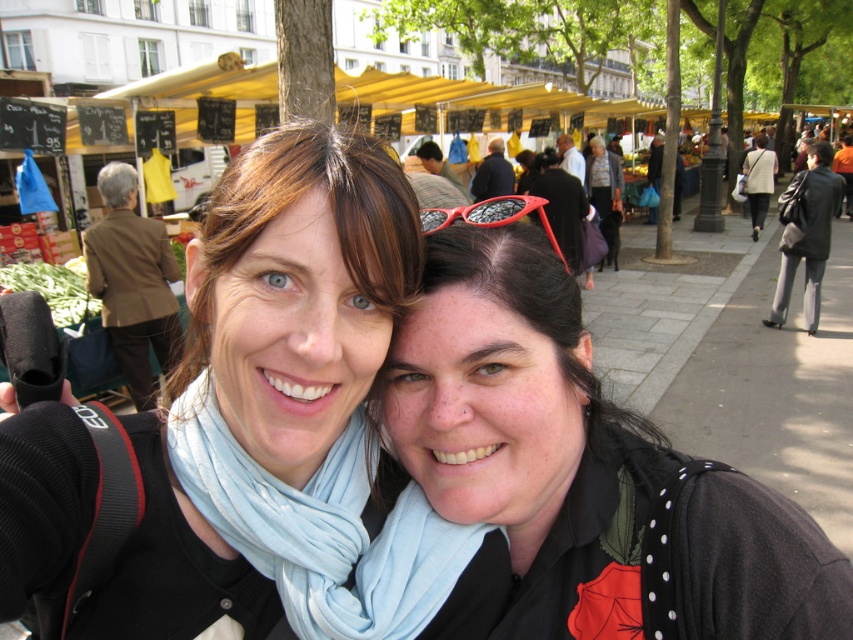
Can you confirm if matte black shirt at center is positioned below brown leather jacket at left?

Yes, matte black shirt at center is below brown leather jacket at left.

Identify the location of matte black shirt at center. This screenshot has width=853, height=640. (585, 468).

Between point (503, 433) and point (109, 269), which one is positioned behind?

Positioned behind is point (109, 269).

This screenshot has width=853, height=640. Find the location of `matte black shirt at center`. matte black shirt at center is located at coordinates click(585, 468).

From the picture: Between light blue fabric scarf at center and brown leather jacket at left, which one has more height?

Standing taller between the two is brown leather jacket at left.

The image size is (853, 640). Identify the location of light blue fabric scarf at center. (321, 529).

Is point (415, 576) less distant than point (167, 250)?

Yes, point (415, 576) is in front of point (167, 250).

This screenshot has width=853, height=640. I want to click on light blue fabric scarf at center, so click(321, 529).

At what (x,y) coordinates should I click in order to perform the action: click on matte black shirt at center. Please return your answer as a coordinate pair (x, y). This screenshot has height=640, width=853. Looking at the image, I should click on (585, 468).

Does matte black shirt at center have a greater height compared to light blue fabric scarf at center?

Correct, matte black shirt at center is much taller as light blue fabric scarf at center.

Is point (688, 496) positioned in front of point (405, 586)?

Yes, it is in front of point (405, 586).

The width and height of the screenshot is (853, 640). What are the coordinates of `matte black shirt at center` in the screenshot? It's located at (585, 468).